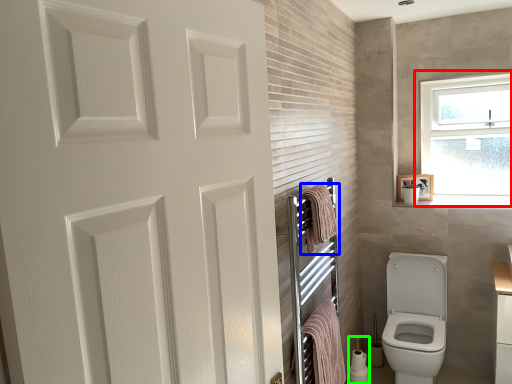
Question: Considering the real-world distances, which object is farthest from window (highlighted by a red box)? bath towel (highlighted by a blue box) or toilet paper (highlighted by a green box)?

Choices:
 (A) bath towel
 (B) toilet paper

Answer: (A)